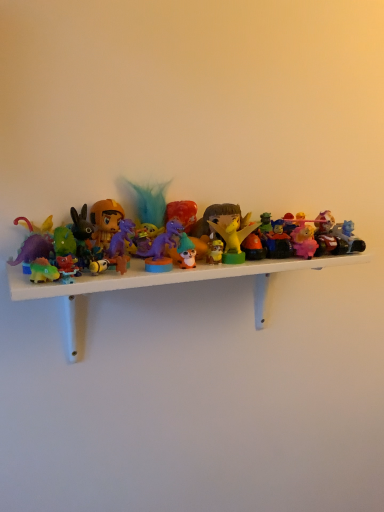
Question: Would you say plastic toys at center contains pink matte figurine at center-right, arranged as the second toy when viewed from the right?

Choices:
 (A) yes
 (B) no

Answer: (B)

Question: Is plastic toys at center not within pink matte figurine at center-right, the 7th toy when ordered from left to right?

Choices:
 (A) yes
 (B) no

Answer: (A)

Question: Can you confirm if plastic toys at center is shorter than pink matte figurine at center-right, the 7th toy when ordered from left to right?

Choices:
 (A) yes
 (B) no

Answer: (B)

Question: Does plastic toys at center have a smaller size compared to pink matte figurine at center-right, arranged as the second toy when viewed from the right?

Choices:
 (A) no
 (B) yes

Answer: (A)

Question: Does plastic toys at center have a lesser width compared to pink matte figurine at center-right, arranged as the second toy when viewed from the right?

Choices:
 (A) no
 (B) yes

Answer: (A)

Question: Considering the positions of matte yellow dragon at center, the 5th toy from the left, and rubber car at center, marked as the 3th toy in a right-to-left arrangement, in the image, is matte yellow dragon at center, the 5th toy from the left, bigger or smaller than rubber car at center, marked as the 3th toy in a right-to-left arrangement,?

Choices:
 (A) small
 (B) big

Answer: (B)

Question: Is matte yellow dragon at center, positioned as the 4th toy in right-to-left order, spatially inside rubber car at center, which is the 6th toy in left-to-right order, or outside of it?

Choices:
 (A) inside
 (B) outside

Answer: (B)

Question: Would you say matte yellow dragon at center, positioned as the 4th toy in right-to-left order, is to the left or to the right of rubber car at center, which is the 6th toy in left-to-right order, in the picture?

Choices:
 (A) right
 (B) left

Answer: (B)

Question: Relative to rubber car at center, which is the 6th toy in left-to-right order, is matte yellow dragon at center, positioned as the 4th toy in right-to-left order, in front or behind?

Choices:
 (A) behind
 (B) front

Answer: (B)

Question: Which is correct: matte yellow dragon at center, positioned as the 4th toy in right-to-left order, is inside pink matte figurine at center-right, arranged as the second toy when viewed from the right, or outside of it?

Choices:
 (A) inside
 (B) outside

Answer: (B)

Question: Considering their positions, is matte yellow dragon at center, positioned as the 4th toy in right-to-left order, located in front of or behind pink matte figurine at center-right, the 7th toy when ordered from left to right?

Choices:
 (A) front
 (B) behind

Answer: (A)

Question: Based on their sizes in the image, would you say matte yellow dragon at center, the 5th toy from the left, is bigger or smaller than pink matte figurine at center-right, arranged as the second toy when viewed from the right?

Choices:
 (A) small
 (B) big

Answer: (B)

Question: From a real-world perspective, is matte yellow dragon at center, the 5th toy from the left, positioned above or below pink matte figurine at center-right, the 7th toy when ordered from left to right?

Choices:
 (A) above
 (B) below

Answer: (A)

Question: From the image's perspective, is matte orange helmet at left, the 1th toy from the left, above or below pink matte figurine at center-right, arranged as the second toy when viewed from the right?

Choices:
 (A) below
 (B) above

Answer: (B)

Question: Considering the positions of matte orange helmet at left, which ranks as the eighth toy in right-to-left order, and pink matte figurine at center-right, arranged as the second toy when viewed from the right, in the image, is matte orange helmet at left, which ranks as the eighth toy in right-to-left order, wider or thinner than pink matte figurine at center-right, arranged as the second toy when viewed from the right,?

Choices:
 (A) wide
 (B) thin

Answer: (B)